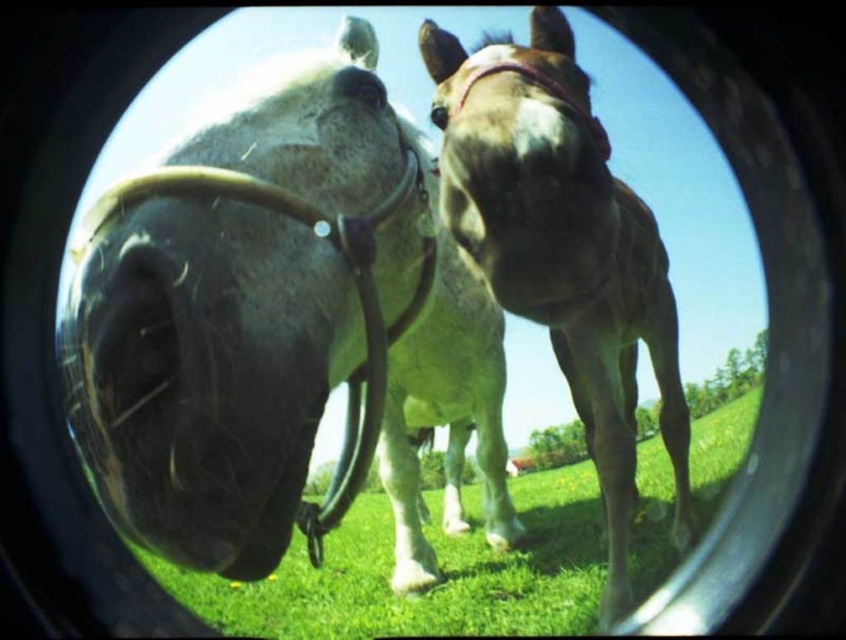
Between point (470, 170) and point (338, 72), which one is positioned behind?

The point (338, 72) is more distant.

Is point (520, 285) closer to viewer compared to point (366, 76)?

Yes.

Find the location of `brown glossy horse at center`. brown glossy horse at center is located at coordinates (562, 248).

How distant is shiny black horse at center from black leather nose at center?

1.56 meters

Does point (150, 307) come farther from viewer compared to point (344, 90)?

No.

You are a GUI agent. You are given a task and a screenshot of the screen. Output one action in this format:
    pyautogui.click(x=<x>, y=<y>)
    Task: Click on the shiny black horse at center
    The height and width of the screenshot is (640, 846).
    Given the screenshot: What is the action you would take?
    pyautogui.click(x=278, y=326)

Is point (411, 349) positioned behind point (520, 166)?

Yes, it is behind point (520, 166).

Between shiny black horse at center and brown glossy horse at center, which one appears on the left side from the viewer's perspective?

Positioned to the left is shiny black horse at center.

Between point (138, 481) and point (600, 449), which one is positioned in front?

Point (138, 481) is more forward.

The width and height of the screenshot is (846, 640). Find the location of `shiny black horse at center`. shiny black horse at center is located at coordinates (278, 326).